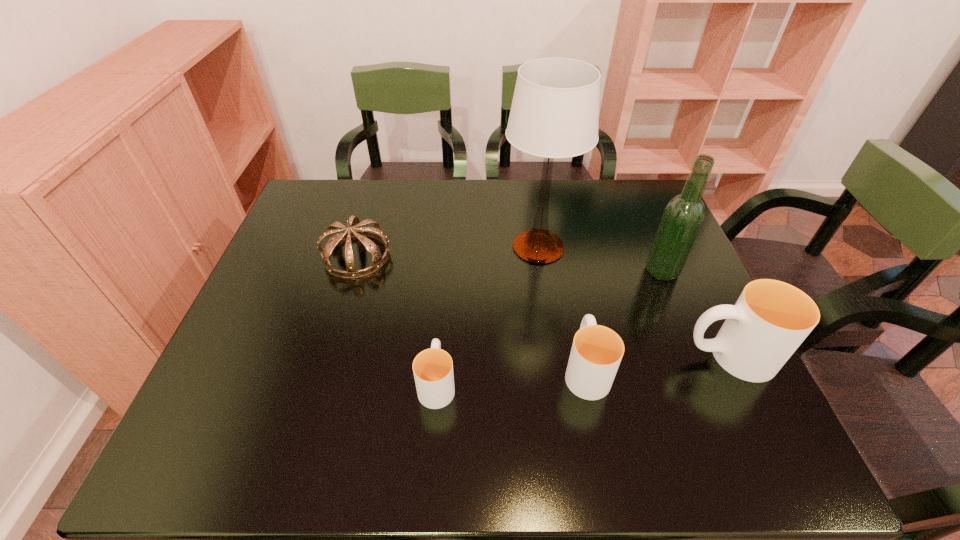
Please point a spot on the left to add another cup. Please provide its 2D coordinates. Your answer should be formatted as a tuple, i.e. [(x, y)], where the tuple contains the x and y coordinates of a point satisfying the conditions above.

[(279, 398)]